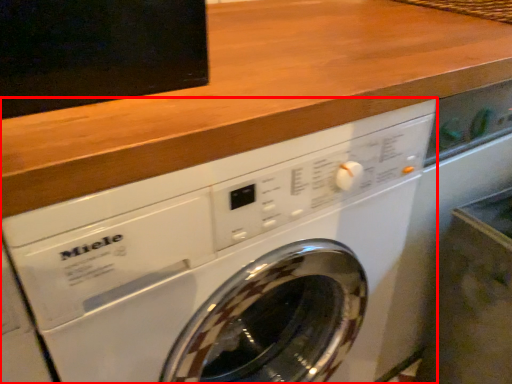
Question: From the image's perspective, what is the correct spatial positioning of washing machine (annotated by the red box) in reference to counter top?

Choices:
 (A) above
 (B) below

Answer: (B)